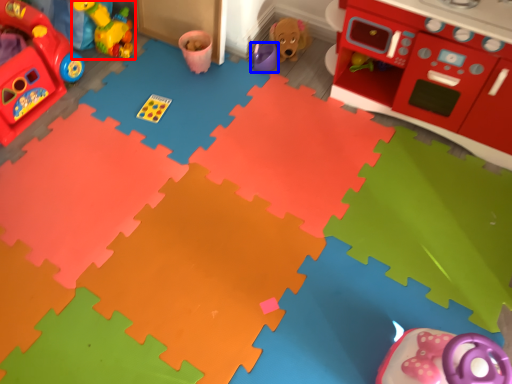
Question: Which object is further to the camera taking this photo, toy (highlighted by a red box) or toy (highlighted by a blue box)?

Choices:
 (A) toy
 (B) toy

Answer: (B)